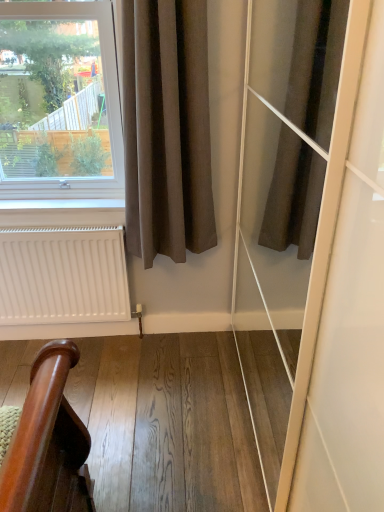
Where is `wooden handrail at lower left`? wooden handrail at lower left is located at coordinates (167, 423).

What is the approximate height of white matte radiator at lower left?

63.22 centimeters.

Describe the element at coordinates (167, 129) in the screenshot. I see `brown cotton curtain at left` at that location.

This screenshot has height=512, width=384. What are the coordinates of `wooden handrail at lower left` in the screenshot? It's located at (167, 423).

Based on the photo, choose the correct answer: Is white matte radiator at lower left inside brown cotton curtain at left or outside it?

white matte radiator at lower left cannot be found inside brown cotton curtain at left.

Considering the sizes of objects white matte radiator at lower left and brown cotton curtain at left in the image provided, who is bigger, white matte radiator at lower left or brown cotton curtain at left?

Bigger between the two is brown cotton curtain at left.

Can you tell me how much white matte radiator at lower left and brown cotton curtain at left differ in facing direction?

0.0683 degrees.

Which object is closer to the camera, white matte radiator at lower left or brown cotton curtain at left?

brown cotton curtain at left is closer to the camera.

Is wooden handrail at lower left oriented away from brown cotton curtain at left?

wooden handrail at lower left is not turned away from brown cotton curtain at left.

Considering the relative sizes of wooden handrail at lower left and brown cotton curtain at left in the image provided, is wooden handrail at lower left shorter than brown cotton curtain at left?

Yes, wooden handrail at lower left is shorter than brown cotton curtain at left.

Is wooden handrail at lower left inside the boundaries of brown cotton curtain at left, or outside?

wooden handrail at lower left is not enclosed by brown cotton curtain at left.

Which is more distant, (218, 362) or (186, 45)?

The point (218, 362) is farther.

Is brown cotton curtain at left looking in the opposite direction of wooden handrail at lower left?

No.

Is wooden handrail at lower left a part of brown cotton curtain at left?

Definitely not — wooden handrail at lower left is not inside brown cotton curtain at left.

From a real-world perspective, is brown cotton curtain at left on top of wooden handrail at lower left?

Correct, in the physical world, brown cotton curtain at left is higher than wooden handrail at lower left.

Is brown cotton curtain at left looking in the opposite direction of white matte radiator at lower left?

brown cotton curtain at left does not have its back to white matte radiator at lower left.

From the image's perspective, is brown cotton curtain at left beneath white matte radiator at lower left?

Actually, brown cotton curtain at left appears above white matte radiator at lower left in the image.

Which is closer, (132, 35) or (126, 309)?

Point (132, 35) is positioned closer to the camera compared to point (126, 309).

Would you say brown cotton curtain at left is a long distance from white matte radiator at lower left?

No.

How distant is white matte radiator at lower left from wooden handrail at lower left?

white matte radiator at lower left is 17.41 inches from wooden handrail at lower left.

From a real-world perspective, is white matte radiator at lower left over wooden handrail at lower left?

Yes, from a real-world perspective, white matte radiator at lower left is on top of wooden handrail at lower left.

From the image's perspective, is white matte radiator at lower left above wooden handrail at lower left?

Indeed, from the image's perspective, white matte radiator at lower left is shown above wooden handrail at lower left.

The height and width of the screenshot is (512, 384). Identify the location of radiator lying behind the wooden handrail at lower left. (63, 276).

Does wooden handrail at lower left turn towards white matte radiator at lower left?

No, wooden handrail at lower left is not turned towards white matte radiator at lower left.

Considering the sizes of objects wooden handrail at lower left and white matte radiator at lower left in the image provided, who is smaller, wooden handrail at lower left or white matte radiator at lower left?

Smaller between the two is white matte radiator at lower left.

You are a GUI agent. You are given a task and a screenshot of the screen. Output one action in this format:
    pyautogui.click(x=<x>, y=<y>)
    Task: Click on the stairwell to the right of white matte radiator at lower left
    
    Given the screenshot: What is the action you would take?
    pyautogui.click(x=167, y=423)

Which of these two, wooden handrail at lower left or white matte radiator at lower left, stands shorter?

With less height is wooden handrail at lower left.

At what (x,y) coordinates should I click in order to perform the action: click on radiator behind the brown cotton curtain at left. Please return your answer as a coordinate pair (x, y). Looking at the image, I should click on (63, 276).

In the image, there is a brown cotton curtain at left. Where is `stairwell below it (from a real-world perspective)`? Image resolution: width=384 pixels, height=512 pixels. stairwell below it (from a real-world perspective) is located at coordinates (167, 423).

From the image, which object appears to be nearer to wooden handrail at lower left, white matte radiator at lower left or brown cotton curtain at left?

The object closer to wooden handrail at lower left is white matte radiator at lower left.

Based on their spatial positions, is brown cotton curtain at left or white matte radiator at lower left closer to wooden handrail at lower left?

white matte radiator at lower left.

Based on their spatial positions, is wooden handrail at lower left or brown cotton curtain at left closer to white matte radiator at lower left?

wooden handrail at lower left is closer to white matte radiator at lower left.

Which object lies nearer to the anchor point white matte radiator at lower left, brown cotton curtain at left or wooden handrail at lower left?

Among the two, wooden handrail at lower left is located nearer to white matte radiator at lower left.

Which object lies further to the anchor point brown cotton curtain at left, wooden handrail at lower left or white matte radiator at lower left?

wooden handrail at lower left lies further to brown cotton curtain at left than the other object.

Estimate the real-world distances between objects in this image. Which object is closer to brown cotton curtain at left, white matte radiator at lower left or wooden handrail at lower left?

The object closer to brown cotton curtain at left is white matte radiator at lower left.

Where is `radiator between brown cotton curtain at left and wooden handrail at lower left vertically`? This screenshot has width=384, height=512. radiator between brown cotton curtain at left and wooden handrail at lower left vertically is located at coordinates (63, 276).